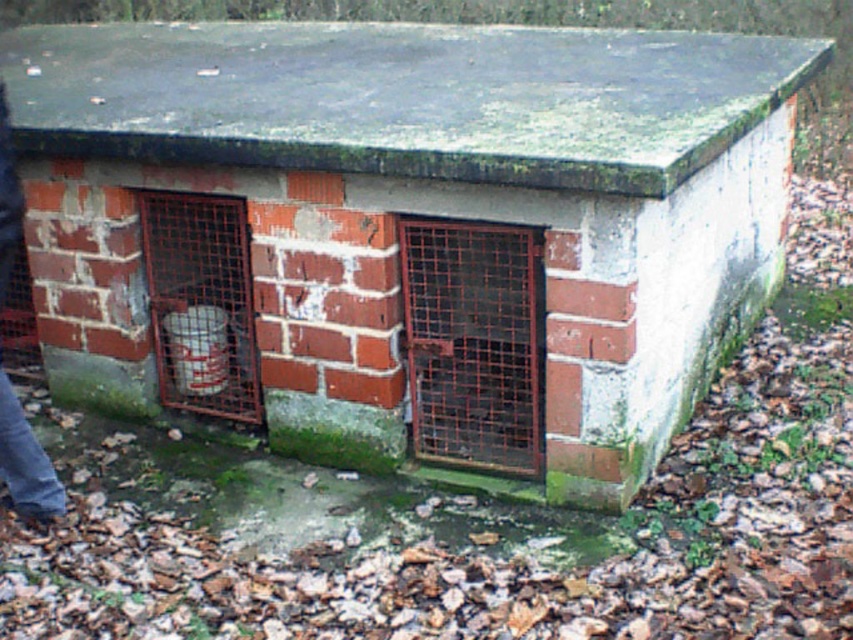
Is white plastic bucket at left to the left of jeans at lower left from the viewer's perspective?

In fact, white plastic bucket at left is to the right of jeans at lower left.

Is white plastic bucket at left bigger than jeans at lower left?

Yes, white plastic bucket at left is bigger than jeans at lower left.

Locate an element on the screen. The height and width of the screenshot is (640, 853). white plastic bucket at left is located at coordinates (201, 304).

Can you confirm if rusty metal cage at center is bigger than jeans at lower left?

Yes, rusty metal cage at center is bigger than jeans at lower left.

Is point (425, 289) more distant than point (21, 448)?

Yes, it is behind point (21, 448).

The width and height of the screenshot is (853, 640). I want to click on rusty metal cage at center, so click(x=473, y=342).

At what (x,y) coordinates should I click in order to perform the action: click on rusty metal cage at center. Please return your answer as a coordinate pair (x, y). Looking at the image, I should click on (473, 342).

Is rusty metal cage at center to the right of white plastic bucket at left from the viewer's perspective?

Indeed, rusty metal cage at center is positioned on the right side of white plastic bucket at left.

Who is lower down, rusty metal cage at center or white plastic bucket at left?

rusty metal cage at center

Does point (456, 252) come in front of point (202, 284)?

Yes, point (456, 252) is closer to viewer.

Where is `rusty metal cage at center`? The height and width of the screenshot is (640, 853). rusty metal cage at center is located at coordinates (473, 342).